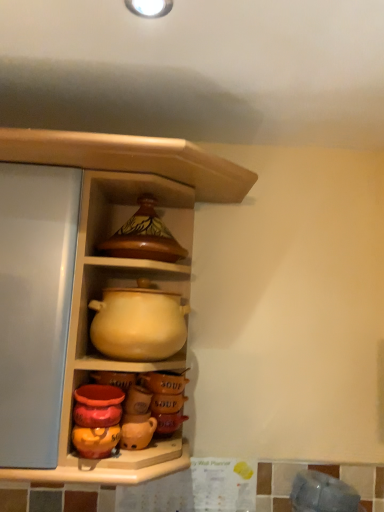
Question: Is matte ceramic pot at upper center outside brown glossy pot at upper center?

Choices:
 (A) no
 (B) yes

Answer: (B)

Question: Can you confirm if matte ceramic pot at upper center is taller than brown glossy pot at upper center?

Choices:
 (A) yes
 (B) no

Answer: (A)

Question: From the image's perspective, is matte ceramic pot at upper center on top of brown glossy pot at upper center?

Choices:
 (A) no
 (B) yes

Answer: (A)

Question: Is matte ceramic pot at upper center shorter than brown glossy pot at upper center?

Choices:
 (A) yes
 (B) no

Answer: (B)

Question: Is matte ceramic pot at upper center facing away from brown glossy pot at upper center?

Choices:
 (A) no
 (B) yes

Answer: (B)

Question: Is matte ceramic pot at upper center at the left side of brown glossy pot at upper center?

Choices:
 (A) yes
 (B) no

Answer: (B)

Question: Can you confirm if matte ceramic pot at upper center is taller than matte yellow clay pot at center?

Choices:
 (A) yes
 (B) no

Answer: (A)

Question: Is matte ceramic pot at upper center positioned with its back to matte yellow clay pot at center?

Choices:
 (A) no
 (B) yes

Answer: (B)

Question: Does matte ceramic pot at upper center have a greater width compared to matte yellow clay pot at center?

Choices:
 (A) no
 (B) yes

Answer: (B)

Question: Are matte ceramic pot at upper center and matte yellow clay pot at center making contact?

Choices:
 (A) no
 (B) yes

Answer: (A)

Question: From the image's perspective, would you say matte ceramic pot at upper center is shown under matte yellow clay pot at center?

Choices:
 (A) yes
 (B) no

Answer: (B)

Question: Would you consider matte ceramic pot at upper center to be distant from matte yellow clay pot at center?

Choices:
 (A) no
 (B) yes

Answer: (A)

Question: Is matte yellow clay pot at center not close to matte ceramic pot at upper center?

Choices:
 (A) no
 (B) yes

Answer: (A)